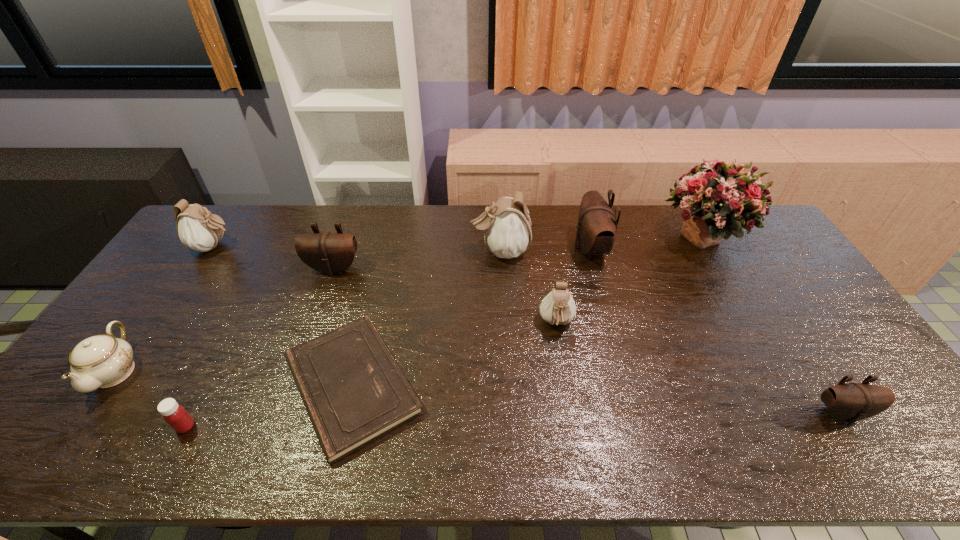
Where is `free area in between the nearest white pouch and the shortest object`? The image size is (960, 540). free area in between the nearest white pouch and the shortest object is located at coordinates (454, 354).

Locate an element on the screen. Image resolution: width=960 pixels, height=540 pixels. free space between the ninth tallest object and the leftmost pouch is located at coordinates (200, 336).

Identify the location of vacant space in between the biggest white pouch and the smallest white pouch. This screenshot has height=540, width=960. (528, 287).

Locate an element on the screen. object that can be found as the second closest to the paperback book is located at coordinates (326, 252).

The width and height of the screenshot is (960, 540). Identify the location of object that is the second closest to the fifth pouch from left to right. (558, 307).

Locate which pouch is the third closest to the biggest white pouch. Please provide its 2D coordinates. Your answer should be formatted as a tuple, i.e. [(x, y)], where the tuple contains the x and y coordinates of a point satisfying the conditions above.

[(326, 252)]

Find the location of a particular element. This screenshot has width=960, height=540. pouch object that ranks as the second closest to the rightmost pouch is located at coordinates (597, 225).

Where is `white pouch that can be found as the second closest to the red medicine`? The image size is (960, 540). white pouch that can be found as the second closest to the red medicine is located at coordinates (506, 224).

Select which white pouch is the closest to the chinaware. Please provide its 2D coordinates. Your answer should be formatted as a tuple, i.e. [(x, y)], where the tuple contains the x and y coordinates of a point satisfying the conditions above.

[(197, 228)]

Identify the location of the second closest brown pouch relative to the rightmost brown pouch. (326, 252).